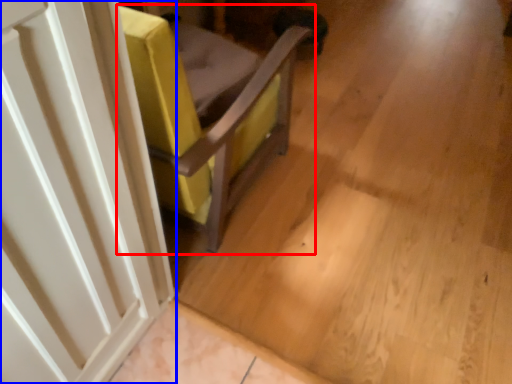
Question: Which point is further to the camera, furniture (highlighted by a red box) or door (highlighted by a blue box)?

Choices:
 (A) furniture
 (B) door

Answer: (A)